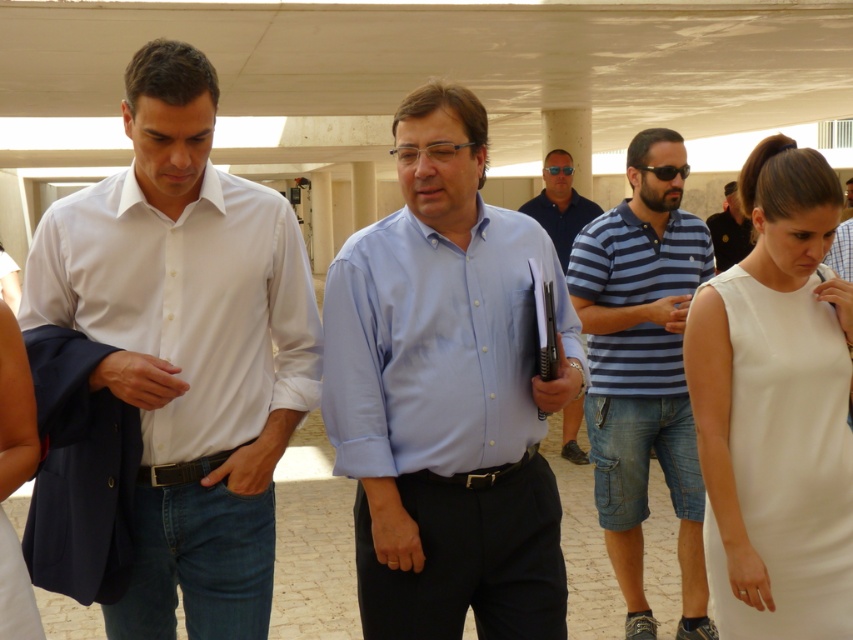
Which is in front, point (641, 392) or point (735, 188)?

Positioned in front is point (641, 392).

Which of these two, blue striped polo shirt at right or black shirt at center, stands taller?

black shirt at center

Which is behind, point (622, 282) or point (712, 221)?

Positioned behind is point (712, 221).

Where is `blue striped polo shirt at right`? This screenshot has height=640, width=853. blue striped polo shirt at right is located at coordinates (637, 259).

Image resolution: width=853 pixels, height=640 pixels. Describe the element at coordinates (643, 369) in the screenshot. I see `blue striped polo shirt at center` at that location.

Does blue striped polo shirt at center appear under blue striped polo shirt at right?

Correct, blue striped polo shirt at center is located below blue striped polo shirt at right.

You are a GUI agent. You are given a task and a screenshot of the screen. Output one action in this format:
    pyautogui.click(x=<x>, y=<y>)
    Task: Click on the blue striped polo shirt at center
    Image resolution: width=853 pixels, height=640 pixels.
    Given the screenshot: What is the action you would take?
    pyautogui.click(x=643, y=369)

Find the location of `blue striped polo shirt at center`. blue striped polo shirt at center is located at coordinates (643, 369).

Can you confirm if light blue button-down shirt at center is smaller than black shirt at center?

Yes, light blue button-down shirt at center is smaller than black shirt at center.

Does light blue button-down shirt at center have a greater height compared to black shirt at center?

Correct, light blue button-down shirt at center is much taller as black shirt at center.

Who is more forward, (405, 340) or (743, 257)?

Positioned in front is point (405, 340).

The width and height of the screenshot is (853, 640). I want to click on light blue button-down shirt at center, so click(x=447, y=394).